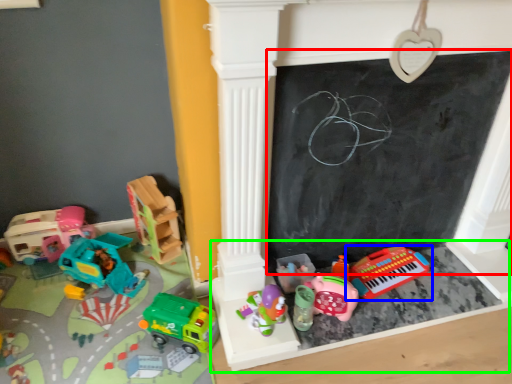
Question: Which object is positioned closest to bulletin board (highlighted by a red box)? Select from toy (highlighted by a blue box) and furniture (highlighted by a green box).

Choices:
 (A) toy
 (B) furniture

Answer: (A)